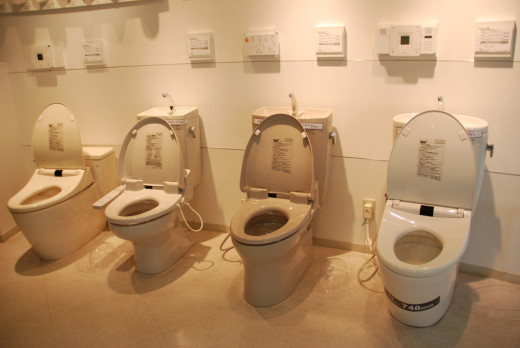
Where is `light brown floor`? This screenshot has width=520, height=348. light brown floor is located at coordinates (195, 315).